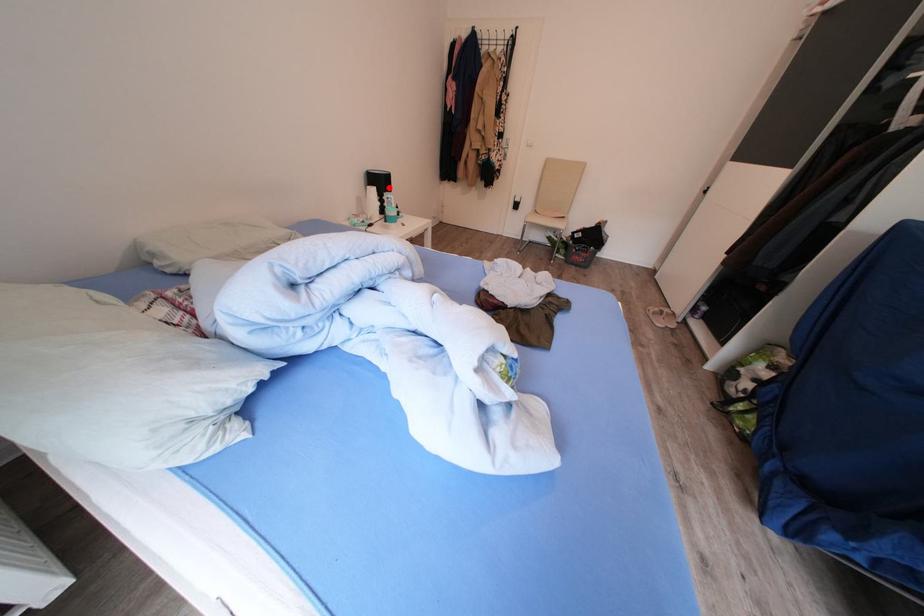
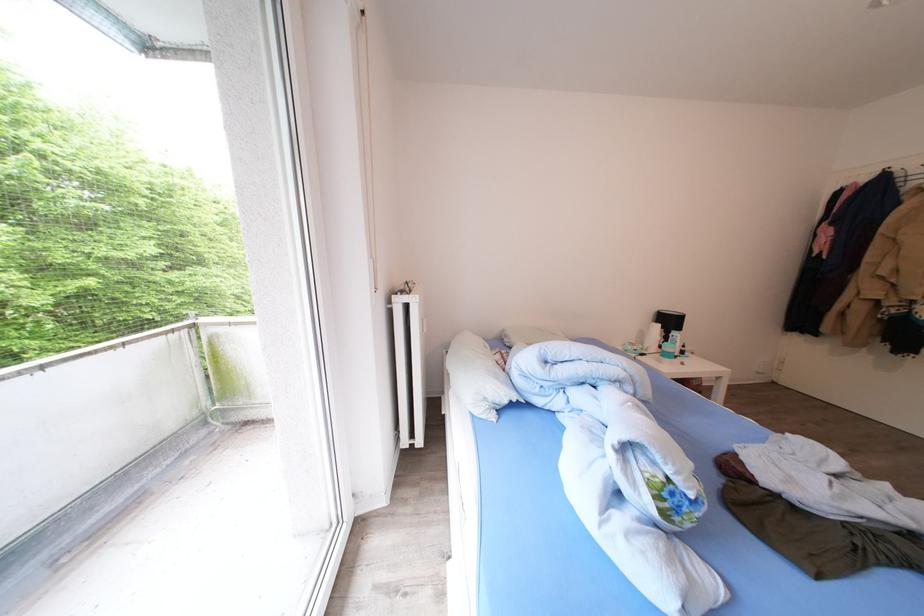
Question: I am providing you with two images of the same scene from different viewpoints. Image1 has a red point marked. In image2, the corresponding 3D location appears at what relative position? Reply with the corresponding letter.

Choices:
 (A) Closer
 (B) Farther

Answer: (B)